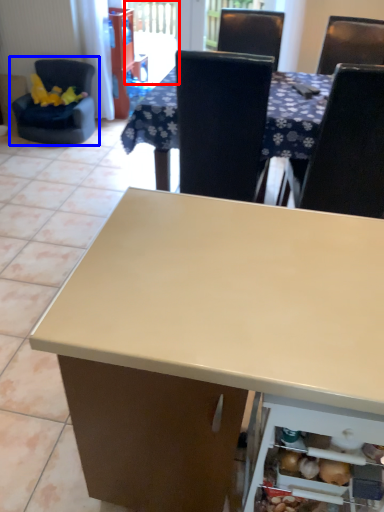
Question: Which point is further to the camera, screen door (highlighted by a red box) or chair (highlighted by a blue box)?

Choices:
 (A) screen door
 (B) chair

Answer: (A)